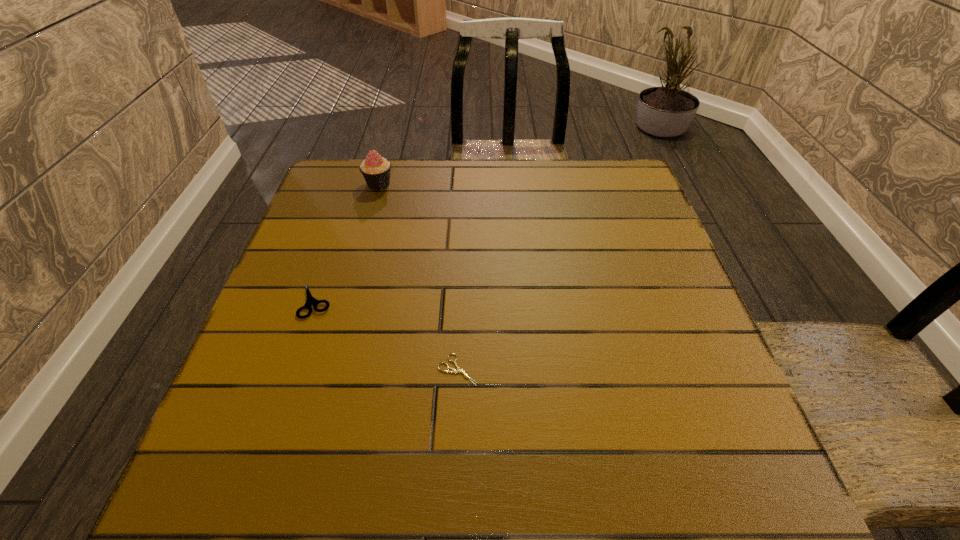
Find the location of a particular element. the tallest object is located at coordinates [376, 170].

Identify the location of the farthest object. The width and height of the screenshot is (960, 540). (376, 170).

Where is `the second nearest object`? The image size is (960, 540). the second nearest object is located at coordinates (310, 300).

The image size is (960, 540). I want to click on the farther shears, so click(x=310, y=300).

The width and height of the screenshot is (960, 540). Find the location of `the shorter shears`. the shorter shears is located at coordinates (459, 370).

Where is `the nearest object`? The width and height of the screenshot is (960, 540). the nearest object is located at coordinates (459, 370).

You are a GUI agent. You are given a task and a screenshot of the screen. Output one action in this format:
    pyautogui.click(x=<x>, y=<y>)
    Task: Click on the free spot located on the front of the farthest object
    The image size is (960, 540).
    Given the screenshot: What is the action you would take?
    pyautogui.click(x=372, y=211)

What are the coordinates of `vacant area situated 0.180m on the back of the farther shears` in the screenshot? It's located at (340, 231).

Where is `free space located 0.290m on the left of the nearer shears`? Image resolution: width=960 pixels, height=540 pixels. free space located 0.290m on the left of the nearer shears is located at coordinates (279, 370).

Find the location of `object present at the far edge`. object present at the far edge is located at coordinates (376, 170).